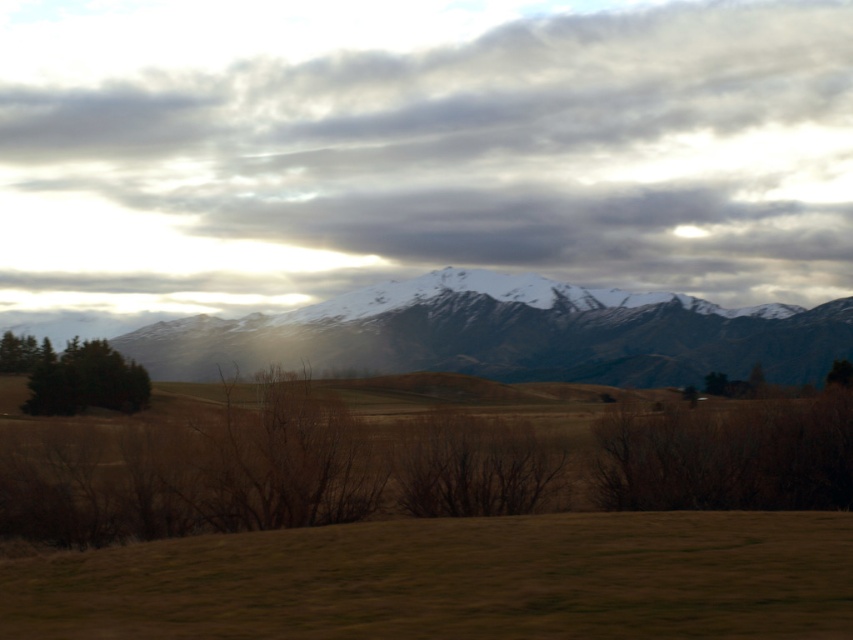
Question: From the image, what is the correct spatial relationship of brown grass at lower center in relation to snowy mountain range at center?

Choices:
 (A) above
 (B) below

Answer: (B)

Question: Is brown grass at lower center to the right of snowy mountain range at center from the viewer's perspective?

Choices:
 (A) no
 (B) yes

Answer: (B)

Question: Considering the real-world distances, which object is farthest from the snowy mountain range at center?

Choices:
 (A) cloudy sky at upper center
 (B) brown grass at lower center
 (C) green matte tree at lower left

Answer: (B)

Question: Can you confirm if snowy mountain range at center is thinner than green matte tree at lower left?

Choices:
 (A) yes
 (B) no

Answer: (B)

Question: Among these objects, which one is farthest from the camera?

Choices:
 (A) cloudy sky at upper center
 (B) snowy mountain range at center
 (C) green matte tree at lower left
 (D) brown grass at lower center

Answer: (A)

Question: Estimate the real-world distances between objects in this image. Which object is farther from the snowy mountain range at center?

Choices:
 (A) cloudy sky at upper center
 (B) brown grass at lower center

Answer: (B)